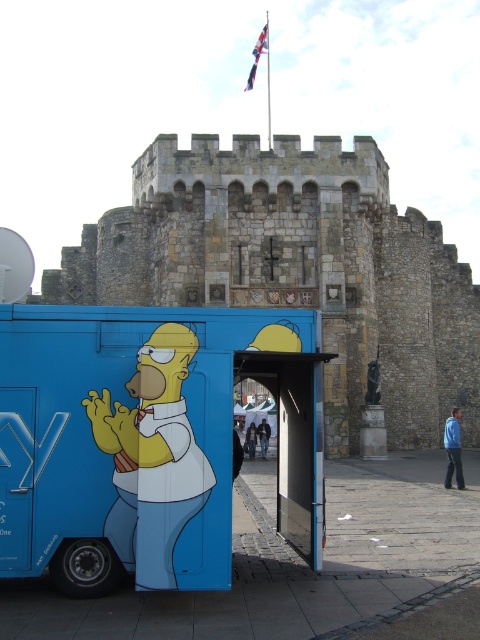
Question: Can you confirm if matte blue food truck at center is bigger than stone castle at center?

Choices:
 (A) no
 (B) yes

Answer: (A)

Question: Which object appears farthest from the camera in this image?

Choices:
 (A) matte blue food truck at center
 (B) stone castle at center

Answer: (B)

Question: Is matte blue food truck at center thinner than stone castle at center?

Choices:
 (A) yes
 (B) no

Answer: (A)

Question: Which point is closer to the camera?

Choices:
 (A) matte blue food truck at center
 (B) stone castle at center

Answer: (A)

Question: Can you confirm if matte blue food truck at center is positioned above stone castle at center?

Choices:
 (A) no
 (B) yes

Answer: (A)